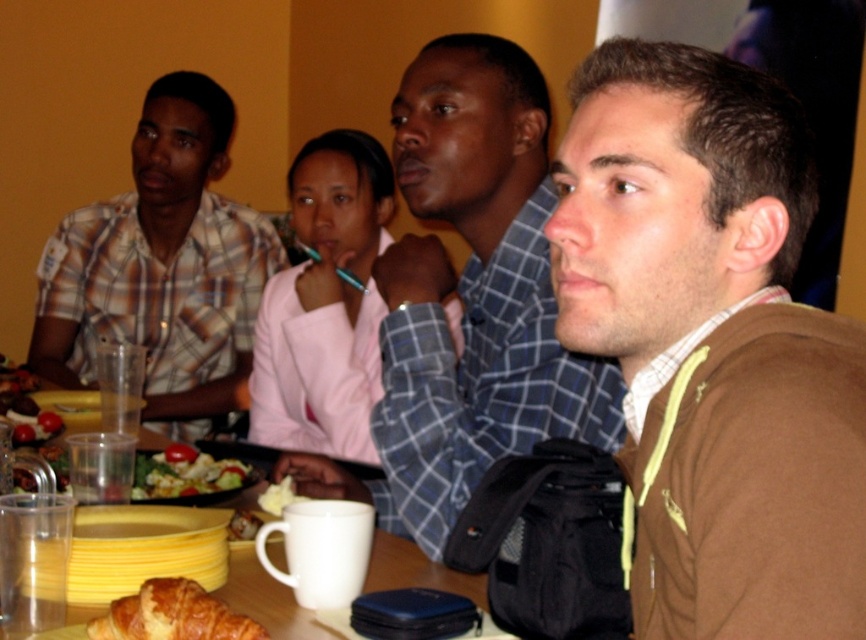
Is point (391, 342) positioned after point (301, 632)?

That is True.

Is point (448, 365) in front of point (139, 570)?

No, it is behind (139, 570).

The height and width of the screenshot is (640, 866). I want to click on matte blue shirt at center, so click(469, 298).

Based on the photo, who is shorter, yellow creamy butter at center or smooth brown bread at lower left?

With less height is smooth brown bread at lower left.

Can you confirm if yellow creamy butter at center is bigger than smooth brown bread at lower left?

Yes, yellow creamy butter at center is bigger than smooth brown bread at lower left.

Locate an element on the screen. This screenshot has width=866, height=640. yellow creamy butter at center is located at coordinates (278, 497).

Does point (198, 616) come in front of point (224, 476)?

Yes, point (198, 616) is closer to viewer.

Between point (114, 612) and point (198, 476), which one is positioned behind?

The point (198, 476) is more distant.

Where is `golden brown flaky croissant at lower left`? golden brown flaky croissant at lower left is located at coordinates (172, 614).